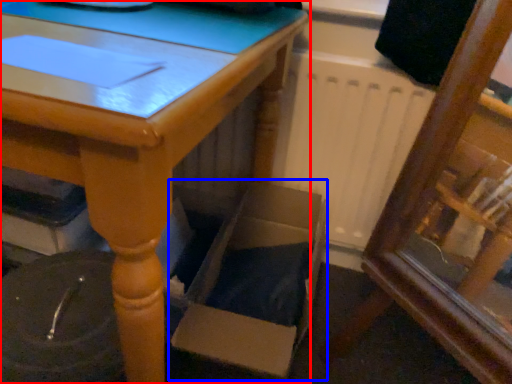
Question: Which of the following is the closest to the observer, table (highlighted by a red box) or cardboard box (highlighted by a blue box)?

Choices:
 (A) table
 (B) cardboard box

Answer: (A)